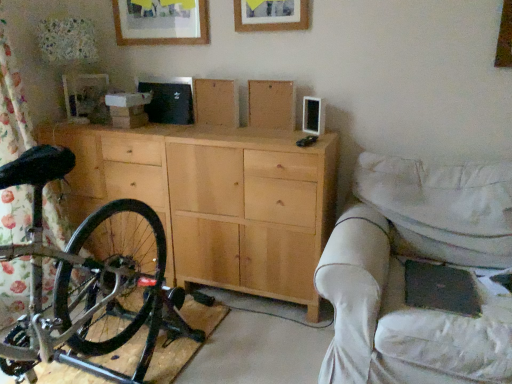
Question: In terms of height, does natural wood cabinet at center look taller or shorter compared to white fabric couch at right?

Choices:
 (A) short
 (B) tall

Answer: (B)

Question: Would you say natural wood cabinet at center is to the left or to the right of white fabric couch at right in the picture?

Choices:
 (A) right
 (B) left

Answer: (B)

Question: Estimate the real-world distances between objects in this image. Which object is closer to the wooden picture frame at upper center, which is the second picture frame from back to front?

Choices:
 (A) white fabric couch at right
 (B) wooden picture frame at upper center, the 2th picture frame in the right-to-left sequence
 (C) natural wood cabinet at center
 (D) shiny black bicycle at left

Answer: (B)

Question: Which object is positioned closest to the wooden picture frame at upper center, which is the second picture frame from back to front?

Choices:
 (A) white fabric couch at right
 (B) natural wood cabinet at center
 (C) shiny black bicycle at left
 (D) wooden picture frame at upper center, which is counted as the second picture frame, starting from the front

Answer: (D)